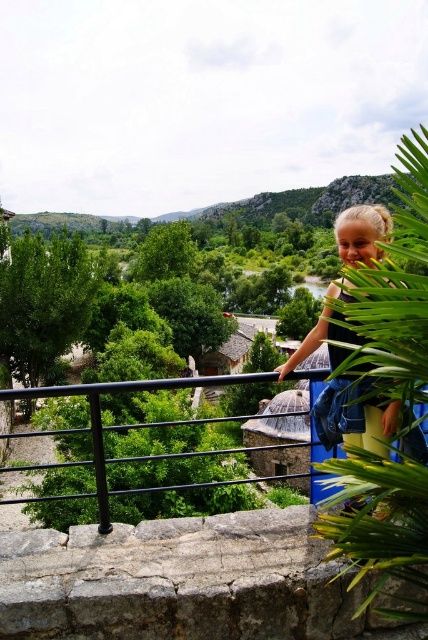
Question: Does rusty stone ledge at lower center appear on the left side of black metal/rail at left?

Choices:
 (A) no
 (B) yes

Answer: (A)

Question: Which object appears farthest from the camera in this image?

Choices:
 (A) green leafy plant at upper right
 (B) rusty stone ledge at lower center

Answer: (B)

Question: Is rusty stone ledge at lower center below blonde hair at upper right?

Choices:
 (A) yes
 (B) no

Answer: (A)

Question: Which point is farther to the camera?

Choices:
 (A) (98, 392)
 (B) (330, 324)
 (C) (300, 579)
 (D) (259, 195)

Answer: (D)

Question: Which of the following is the closest to the observer?

Choices:
 (A) (394, 432)
 (B) (290, 410)
 (C) (39, 588)

Answer: (C)

Question: Is blonde hair at upper right bigger than black metal/rail at left?

Choices:
 (A) yes
 (B) no

Answer: (B)